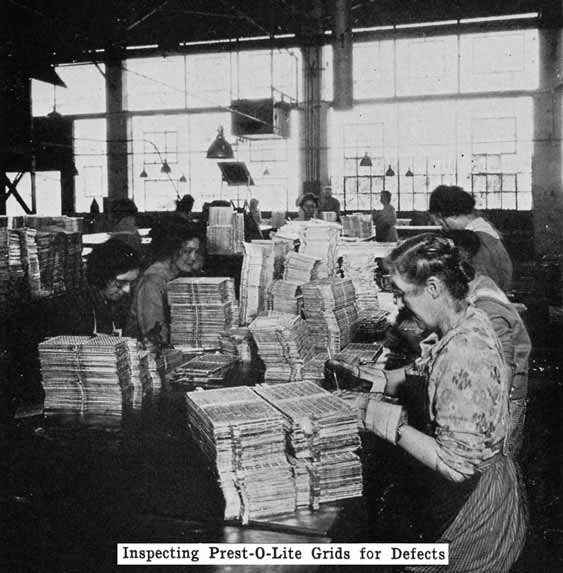
The width and height of the screenshot is (563, 573). What are the coordinates of `light` in the screenshot? It's located at (217, 144).